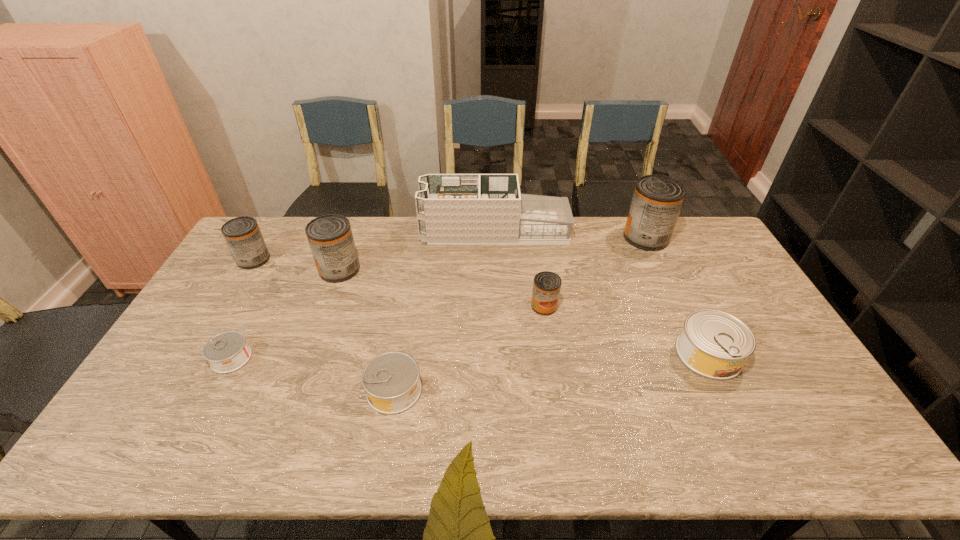
This screenshot has height=540, width=960. I want to click on the rightmost red can, so click(x=657, y=200).

This screenshot has height=540, width=960. Identify the location of the biggest red can. (657, 200).

The image size is (960, 540). Identify the location of dollhouse. (452, 209).

At what (x,y) coordinates should I click in order to perform the action: click on the sixth object from right to left. Please return your answer as a coordinate pair (x, y). Looking at the image, I should click on point(330,237).

Identify the location of the second red can from left to right. Image resolution: width=960 pixels, height=540 pixels. (330, 237).

The width and height of the screenshot is (960, 540). In order to click on the leftmost red can in this screenshot , I will do `click(242, 234)`.

The width and height of the screenshot is (960, 540). What are the coordinates of `the fifth shortest can` in the screenshot? It's located at (242, 234).

Where is `the second red can from right to left`? This screenshot has height=540, width=960. the second red can from right to left is located at coordinates (546, 286).

Where is `the fourth farthest can`? the fourth farthest can is located at coordinates (546, 286).

Identify the location of the rightmost silver can. (714, 344).